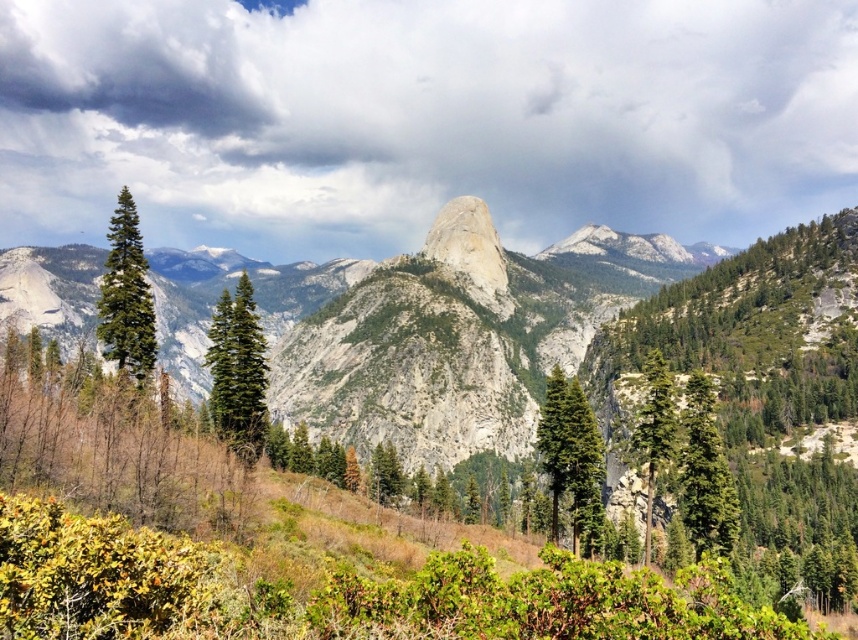
Consider the image. You are standing in the mountain landscape and want to determine which of the two points, point (222,429) or point (650,365), is closer to you. Based on the scene description, which point is nearer?

Point (222,429) is closer to you because it is further to the viewer than point (650,365).

You are standing at the origin point of the coordinate system in the image. Which direction should you move to reach the green matte tree at center?

You should move towards the positive x and y direction to reach the green matte tree at center, as it is located at point (571, 456).